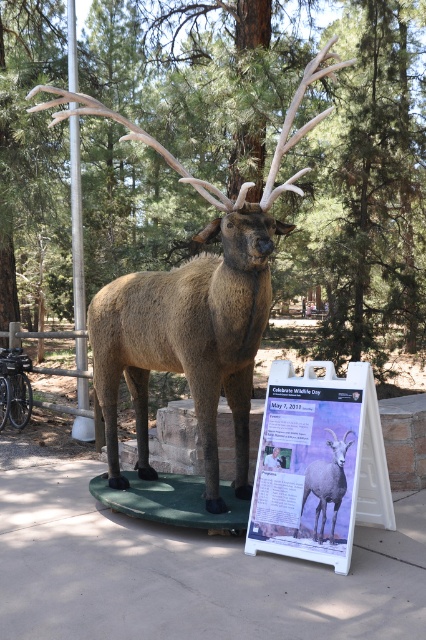
Which of these two, matte white signboard at center or gray woolly sheep at center, stands shorter?

With less height is gray woolly sheep at center.

I want to click on matte white signboard at center, so click(307, 474).

Between point (273, 433) and point (324, 472), which one is positioned in front?

Point (324, 472)

At what (x,y) coordinates should I click in order to perform the action: click on matte white signboard at center. Please return your answer as a coordinate pair (x, y). Looking at the image, I should click on (307, 474).

Between brown matte deer at center and gray woolly sheep at center, which one is positioned higher?

brown matte deer at center

Find the location of a particular element. brown matte deer at center is located at coordinates (192, 305).

This screenshot has height=640, width=426. Identify the location of brown matte deer at center. (192, 305).

Is point (238, 330) more distant than point (250, 540)?

Yes, it is.

Who is taller, brown matte deer at center or matte white signboard at center?

Standing taller between the two is brown matte deer at center.

Is point (250, 221) farther from camera compared to point (331, 548)?

Yes, it is.

The width and height of the screenshot is (426, 640). In order to click on brown matte deer at center in this screenshot , I will do tap(192, 305).